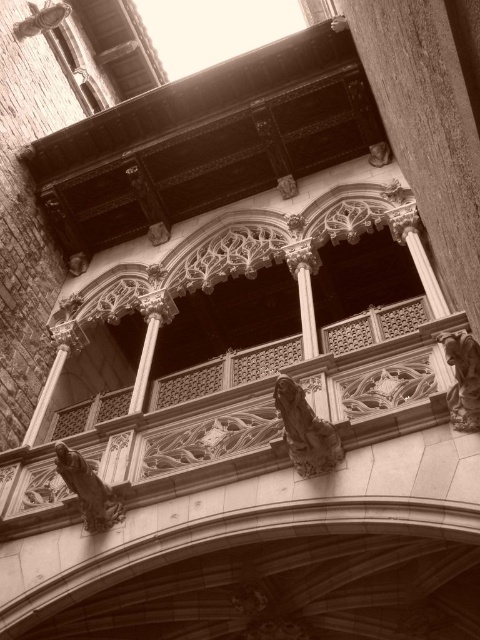
Who is more forward, (302, 420) or (448, 401)?

Point (448, 401) is more forward.

Does point (310, 412) come closer to viewer compared to point (471, 369)?

No, (310, 412) is further to viewer.

Find the location of a particular element. The width and height of the screenshot is (480, 640). stone statue at center is located at coordinates (305, 429).

Which is behind, point (304, 515) or point (106, 496)?

The point (106, 496) is behind.

Consider the image. Who is more forward, [336,524] or [85,500]?

Point [336,524]

You are a GUI agent. You are given a task and a screenshot of the screen. Output one action in this format:
    pyautogui.click(x=<x>, y=<y>)
    Task: Click on the smooth stone archway at center
    
    Given the screenshot: What is the action you would take?
    pyautogui.click(x=200, y=538)

Which of these two, stone statue at center or dark stone gargoyle at lower left, stands shorter?

With less height is dark stone gargoyle at lower left.

Is point (324, 458) positioned in front of point (103, 520)?

That is True.

Does point (324, 432) come behind point (96, 524)?

No, it is not.

This screenshot has height=640, width=480. I want to click on stone statue at center, so click(x=305, y=429).